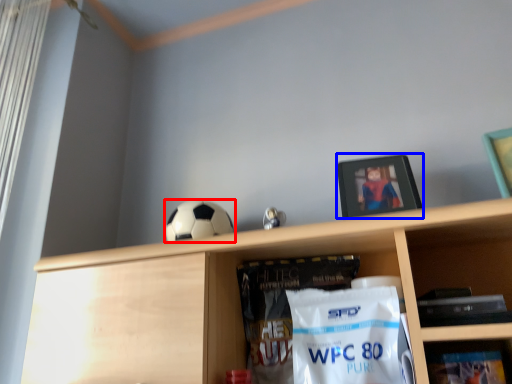
Question: Which object is further to the camera taking this photo, football (highlighted by a red box) or picture frame (highlighted by a blue box)?

Choices:
 (A) football
 (B) picture frame

Answer: (A)